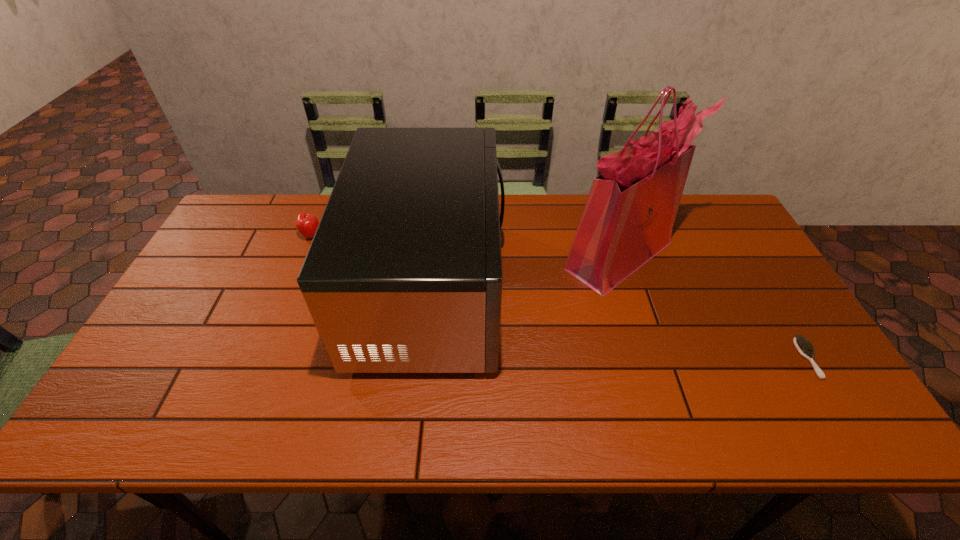
Image resolution: width=960 pixels, height=540 pixels. What are the coordinates of `vacant point at the far left corner` in the screenshot? It's located at (238, 220).

Find the location of a particular element. vacant space at the near left corner of the desktop is located at coordinates (107, 420).

The image size is (960, 540). I want to click on vacant region at the near right corner of the desktop, so click(x=783, y=420).

Identify the location of free point between the third shortest object and the shopping bag. This screenshot has height=540, width=960. (525, 272).

This screenshot has width=960, height=540. I want to click on free space between the scrubbing brush and the second object from left to right, so click(619, 323).

Identify the location of free space that is in between the second object from right to left and the scrubbing brush. (714, 307).

Image resolution: width=960 pixels, height=540 pixels. What are the coordinates of `empty space that is in between the second object from left to right and the third object from left to right` in the screenshot? It's located at (525, 272).

Locate an element on the screen. The image size is (960, 540). object that ranks as the closest to the third object from left to right is located at coordinates (404, 273).

Locate which object ranks in proximity to the second object from left to right. Please provide its 2D coordinates. Your answer should be formatted as a tuple, i.e. [(x, y)], where the tuple contains the x and y coordinates of a point satisfying the conditions above.

[(306, 223)]

Where is `free space that satisfies the following two spatial constraints: 1. on the back side of the shortest object; 2. on the front-facing side of the second object from left to right`? The width and height of the screenshot is (960, 540). free space that satisfies the following two spatial constraints: 1. on the back side of the shortest object; 2. on the front-facing side of the second object from left to right is located at coordinates (765, 289).